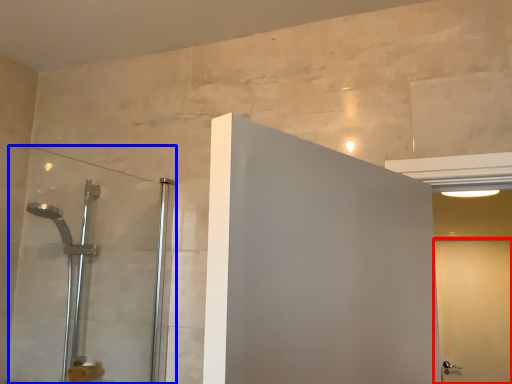
Question: Which object is further to the camera taking this photo, screen door (highlighted by a red box) or shower door (highlighted by a blue box)?

Choices:
 (A) screen door
 (B) shower door

Answer: (A)